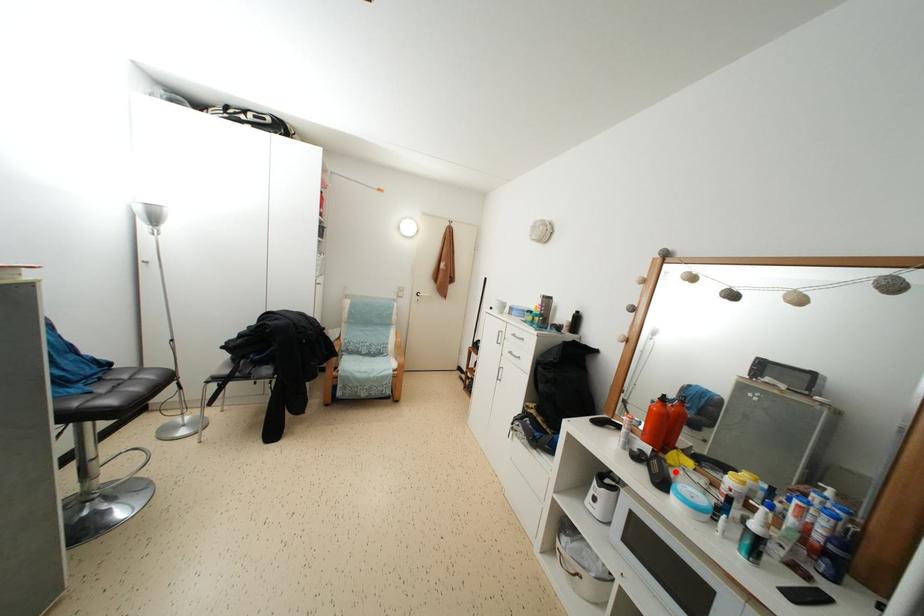
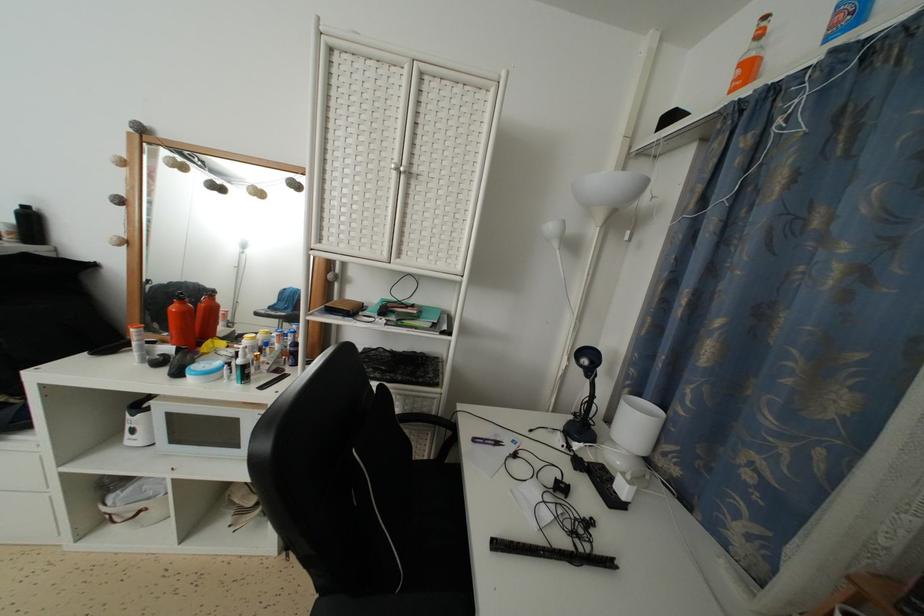
The point at the highlighted location is marked in the first image. Where is the corresponding point in the second image?

(209, 360)